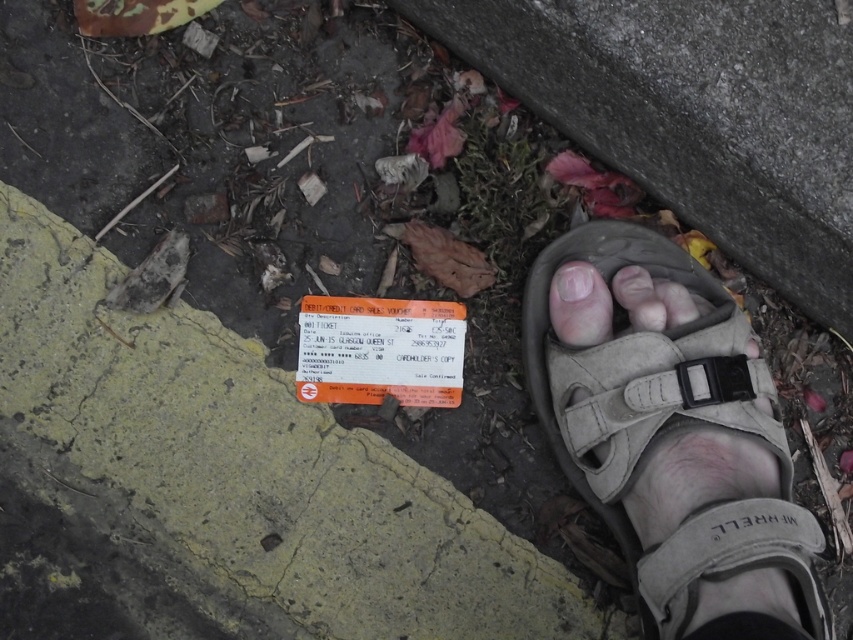
You are standing in an outdoor area with a tan suede sandal at lower right. You want to pick up the ticket on the ground without moving your feet. Can you reach the ticket from where you are standing?

The tan suede sandal at lower right is 32.63 inches from the camera, which means the ticket on the ground is within reach if your arm can extend that far. However, since the exact distance of the ticket isn

You are a photographer trying to capture the ticket on the ground. You notice the pale skin toe at center and the pink flesh at center. Which one is closer to the ticket?

The pink flesh at center is closer to the ticket because the pale skin toe at center is positioned on the right side of it.

You are a person trying to pick up the ticket on the ground. Your pale skin toe at center is near the ticket. There is also a tan suede sandal at lower right. Which object is closer to the ticket?

The pale skin toe at center is closer to the ticket because the tan suede sandal at lower right has a larger size compared to the pale skin toe at center, but size does not indicate distance. Wait, the description says the sandal is larger in size, but the question is about proximity. Hmm, maybe I need to reevaluate. The Objects Description only mentions size comparison, not distance. Therefore, the answer cannot be determined based on the given information. However, since the toe is at the center and the